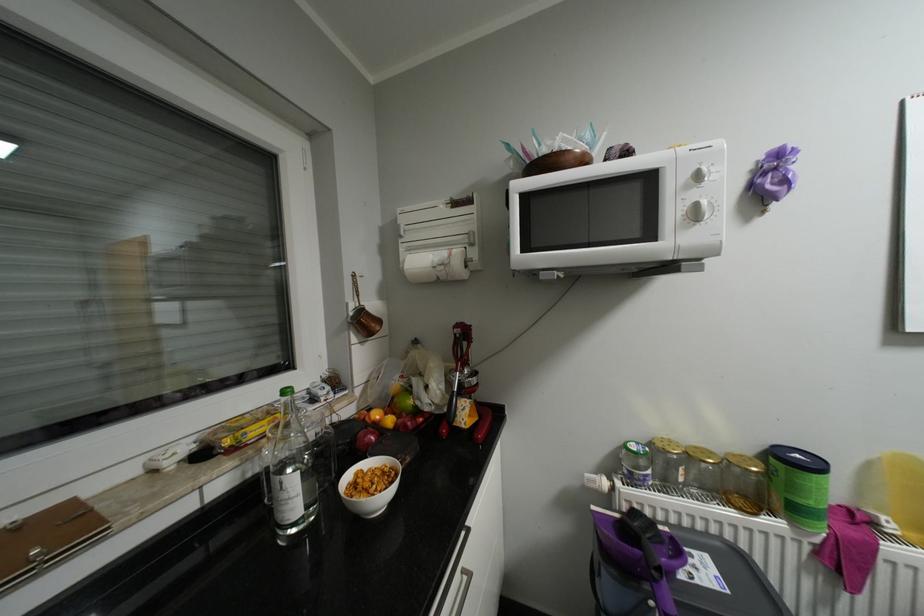
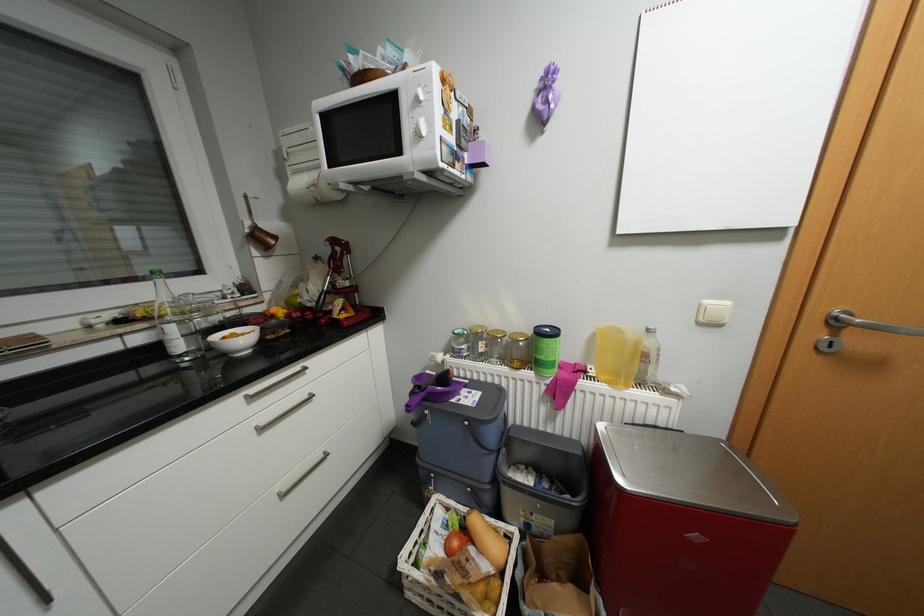
Where in the second image is the point corresponding to the point at 418,249 from the first image?

(302, 172)